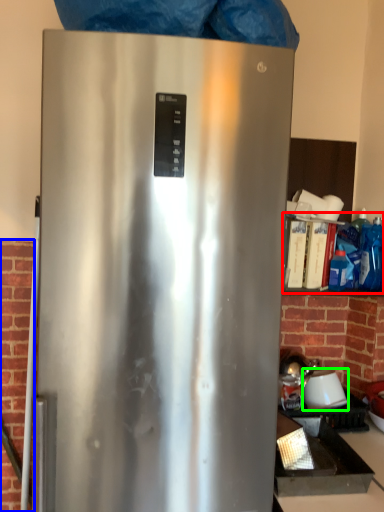
Question: Which object is positioned farthest from shelf (highlighted by a red box)? Select from brickwork (highlighted by a blue box) and appliance (highlighted by a green box).

Choices:
 (A) brickwork
 (B) appliance

Answer: (A)